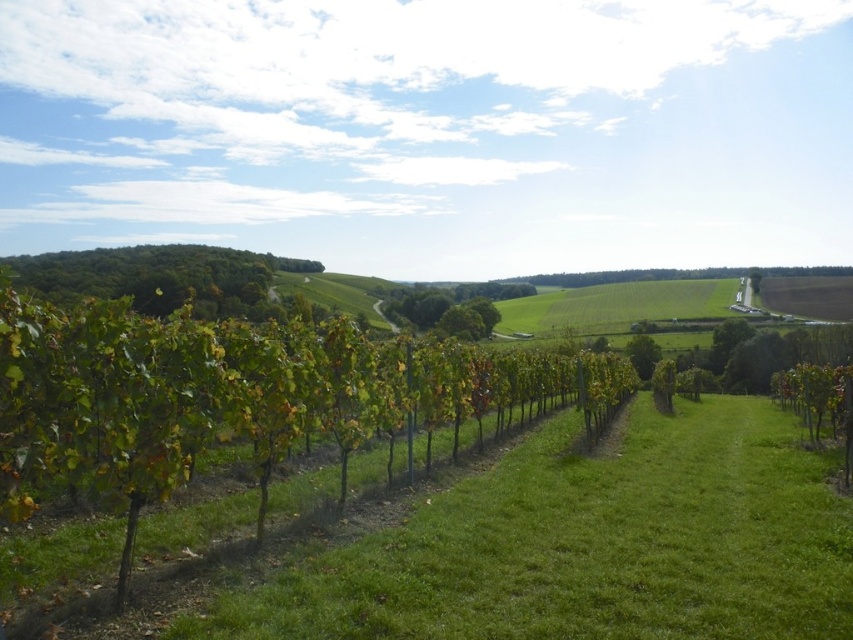
Is green leafy tree at upper left above green leafy tree at center?

Indeed, green leafy tree at upper left is positioned over green leafy tree at center.

Who is more distant from viewer, [91,275] or [657,348]?

The point [91,275] is behind.

Where is `green leafy tree at upper left`? This screenshot has height=640, width=853. green leafy tree at upper left is located at coordinates (160, 276).

In the scene shown: Does green leafy vines at center lie behind green leafy tree at upper left?

No, green leafy vines at center is in front of green leafy tree at upper left.

Between green leafy vines at center and green leafy tree at upper left, which one is positioned higher?

Positioned higher is green leafy tree at upper left.

This screenshot has height=640, width=853. What are the coordinates of `green leafy vines at center` in the screenshot? It's located at (242, 396).

Who is shorter, green leafy vines at center or green leafy tree at center?

green leafy vines at center

I want to click on green leafy vines at center, so click(x=242, y=396).